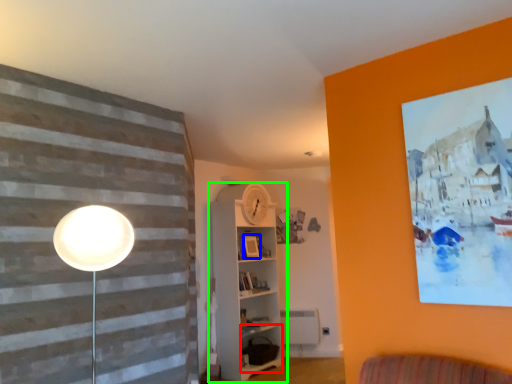
Question: Which object is positioned farthest from shelf (highlighted by a red box)? Select from picture frame (highlighted by a blue box) and shelf (highlighted by a green box).

Choices:
 (A) picture frame
 (B) shelf

Answer: (A)